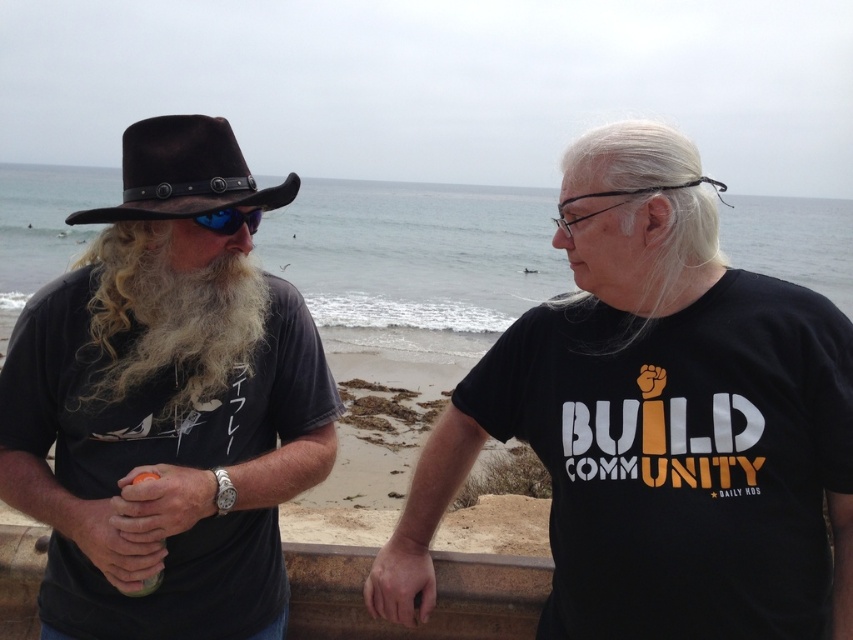
You are standing at the origin point in the image. The black matte t shirt at right is located at point (682, 458). Which direction should you move to reach the black matte t shirt at right?

The black matte t shirt at right is located at point (682, 458). To reach it from the origin, you should move towards the right and slightly upwards.

Looking at this image, you are a photographer trying to capture a closeup of the person on the right. You are currently positioned at point (212, 456). To get a better shot, you need to move closer to the person on the right. Should you move towards point (80, 397) or away from it?

You should move towards point (80, 397) because point (212, 456) is further from the camera than point (80, 397), meaning moving toward the latter would bring you closer to the person on the right.